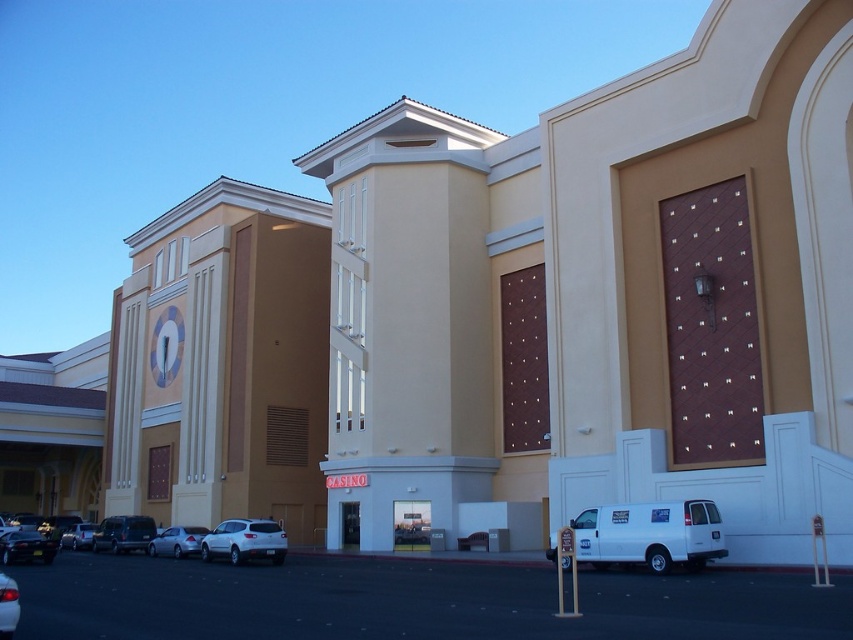
Is point (276, 620) farther from camera compared to point (13, 612)?

Yes, it is.

Does black asphalt parking lot at lower center appear over shiny silver sedan at lower left?

Incorrect, black asphalt parking lot at lower center is not positioned above shiny silver sedan at lower left.

Is point (426, 579) farther from viewer compared to point (10, 616)?

Yes, point (426, 579) is farther from viewer.

The image size is (853, 640). Identify the location of black asphalt parking lot at lower center. (410, 602).

Based on the photo, between white matte van at lower right and silver metallic sedan at lower left, which one has less height?

With less height is silver metallic sedan at lower left.

Who is positioned more to the right, white matte van at lower right or silver metallic sedan at lower left?

Positioned to the right is white matte van at lower right.

Between point (564, 557) and point (78, 538), which one is positioned in front?

Point (564, 557) is in front.

Find the location of a particular element. The width and height of the screenshot is (853, 640). white matte van at lower right is located at coordinates (650, 534).

Is black asphalt parking lot at lower center positioned behind metallic gray suv at lower left?

No.

Which is in front, point (76, 570) or point (134, 531)?

Point (76, 570)

Locate an element on the screen. This screenshot has height=640, width=853. black asphalt parking lot at lower center is located at coordinates (410, 602).